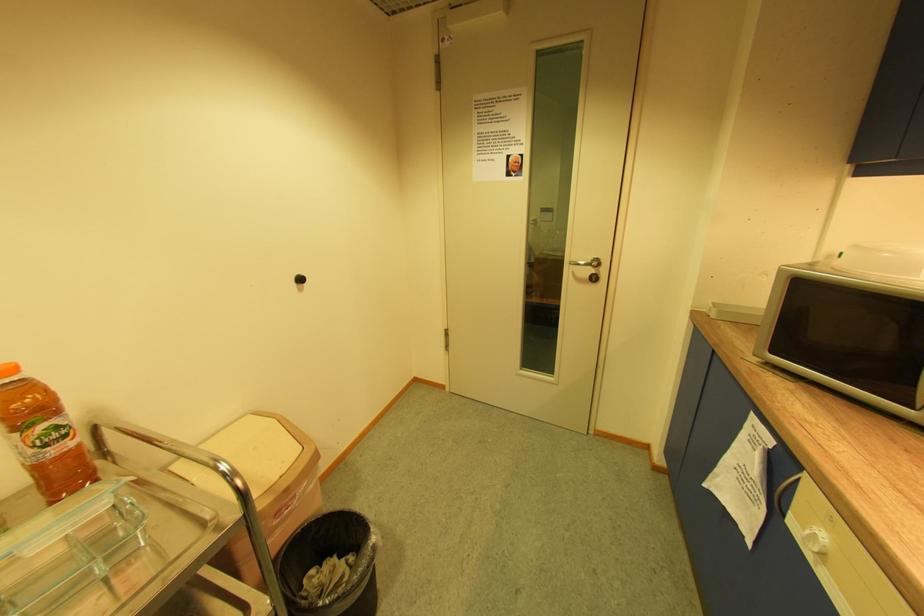
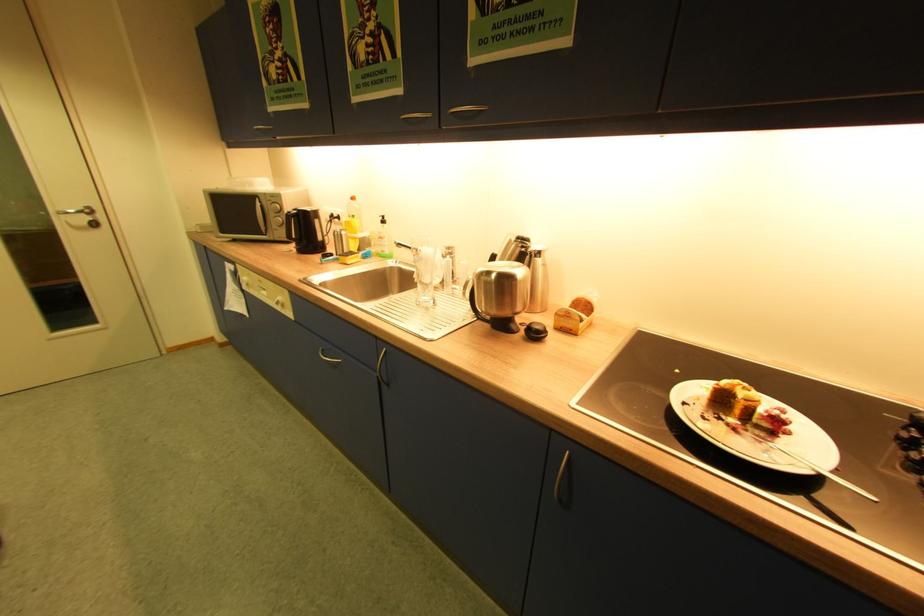
The point at (578, 274) is marked in the first image. Where is the corresponding point in the second image?

(74, 224)